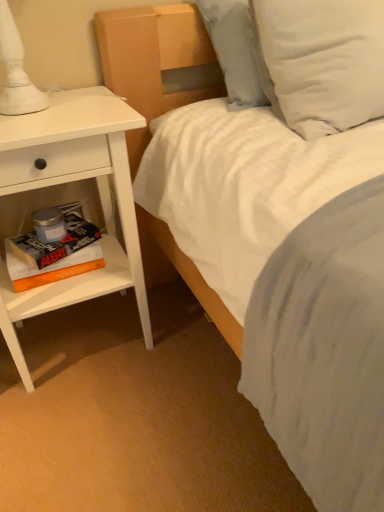
Identify the location of vacant area that lies in front of white matte nightstand at left. (94, 432).